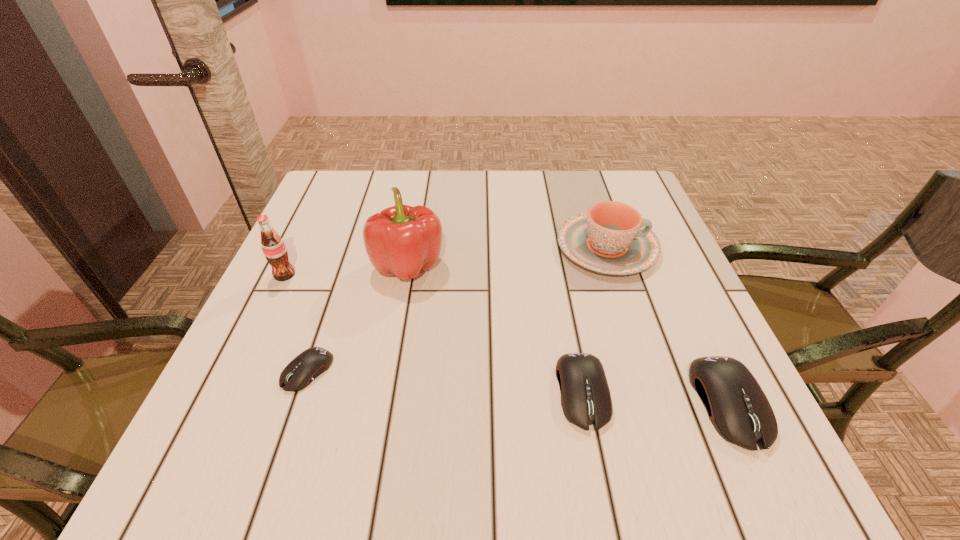
The width and height of the screenshot is (960, 540). I want to click on free space between the second shortest object and the second object from left to right, so click(444, 381).

You are a GUI agent. You are given a task and a screenshot of the screen. Output one action in this format:
    pyautogui.click(x=<x>, y=<y>)
    Task: Click on the vacant area between the leftmost object and the chinaware
    The image size is (960, 540).
    Given the screenshot: What is the action you would take?
    pyautogui.click(x=445, y=261)

Locate an element on the screen. free space between the fourth shortest object and the leftmost object is located at coordinates (445, 261).

You are a GUI agent. You are given a task and a screenshot of the screen. Output one action in this format:
    pyautogui.click(x=<x>, y=<y>)
    Task: Click on the free spot between the second shortest object and the rightmost computer equipment
    The image size is (960, 540).
    Given the screenshot: What is the action you would take?
    pyautogui.click(x=655, y=397)

In order to click on vacant area between the second object from left to right and the third tallest object in this screenshot , I will do click(x=457, y=309).

What are the coordinates of `vacant point located between the pepper and the leftmost object` in the screenshot? It's located at click(347, 269).

Find the location of a particular element. This screenshot has width=960, height=540. object that stands as the second closest to the soda is located at coordinates (302, 370).

Image resolution: width=960 pixels, height=540 pixels. Find the location of `object that is the third closest one to the pepper`. object that is the third closest one to the pepper is located at coordinates (612, 238).

Where is `the closest computer equipment to the second object from left to right`? the closest computer equipment to the second object from left to right is located at coordinates (586, 400).

Locate an element on the screen. computer equipment that stands as the third closest to the chinaware is located at coordinates (302, 370).